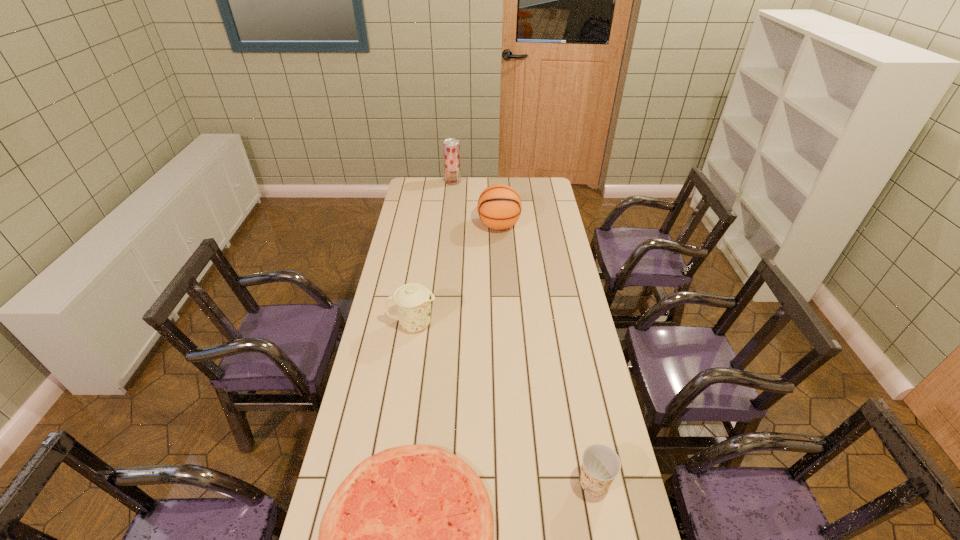
Identify the location of the farthest object. This screenshot has height=540, width=960. (451, 147).

Locate an element on the screen. basketball is located at coordinates (499, 206).

I want to click on the third farthest object, so tap(413, 300).

Image resolution: width=960 pixels, height=540 pixels. I want to click on the third tallest object, so click(413, 300).

At what (x,y) coordinates should I click in order to perform the action: click on the fourth tallest object. Please return your answer as a coordinate pair (x, y). Image resolution: width=960 pixels, height=540 pixels. Looking at the image, I should click on (601, 465).

This screenshot has height=540, width=960. Identify the location of Dixie cup. 601,465.

Where is `vacant space located 0.250m on the front of the fruit juice`? This screenshot has height=540, width=960. vacant space located 0.250m on the front of the fruit juice is located at coordinates (450, 210).

The height and width of the screenshot is (540, 960). Identify the location of vacant space situated 0.320m on the back of the fourth nearest object. (496, 183).

Locate an element on the screen. The width and height of the screenshot is (960, 540). vacant space located 0.230m on the spout of the third shortest object is located at coordinates (498, 324).

In order to click on vacant space located 0.380m on the left of the Dixie cup in this screenshot , I will do `click(438, 483)`.